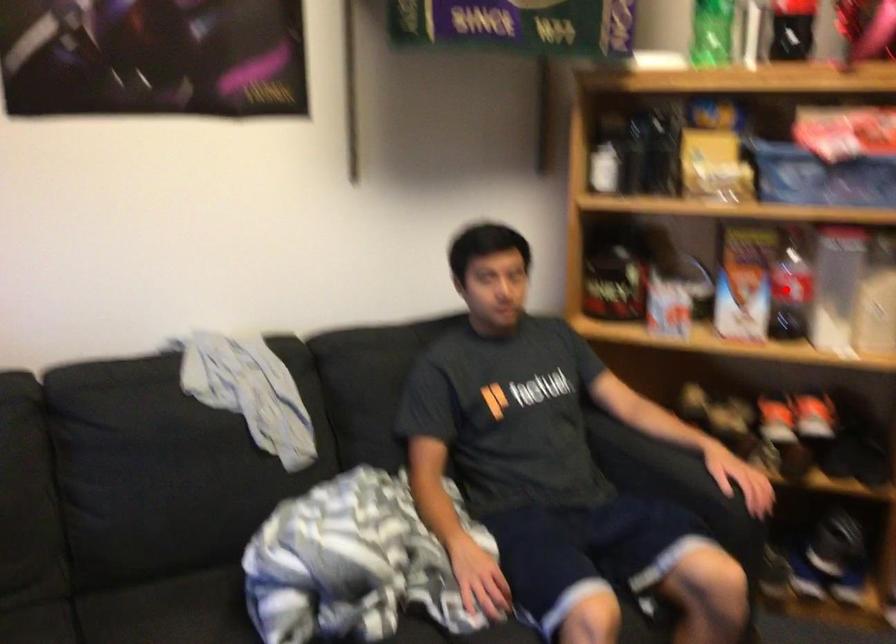
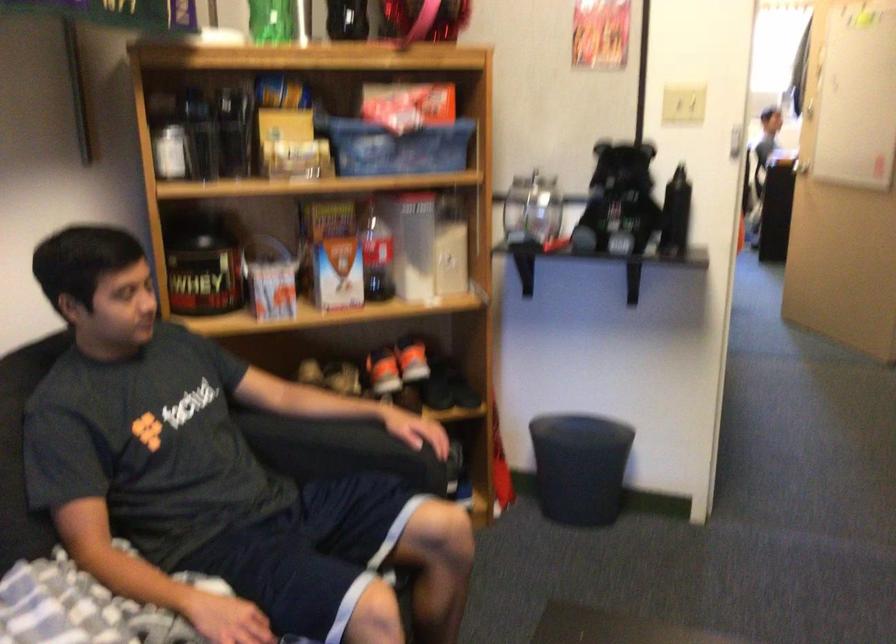
The point at the highlighted location is marked in the first image. Where is the corresponding point in the second image?

(375, 254)